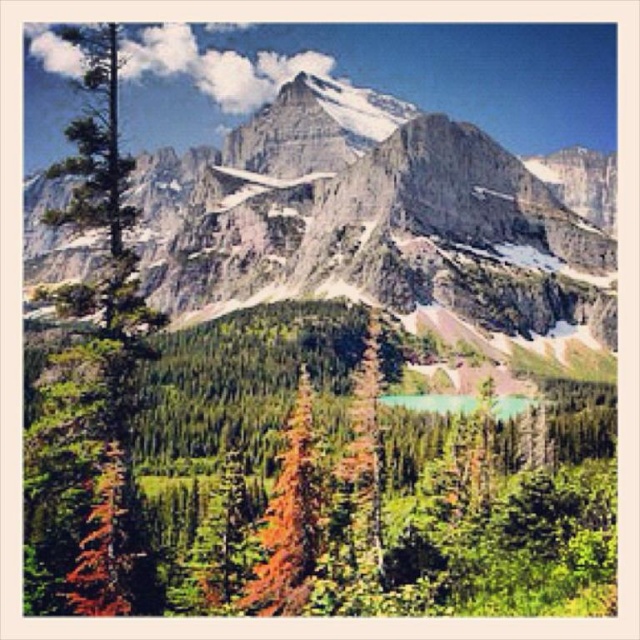
Question: Is orange-brown bark tree at center closer to the viewer compared to green glassy lake at center?

Choices:
 (A) yes
 (B) no

Answer: (A)

Question: Estimate the real-world distances between objects in this image. Which object is farther from the rocky gray mountain range at upper center?

Choices:
 (A) green matte tree at left
 (B) green glassy lake at center
 (C) green matte tree at center
 (D) orange-brown bark tree at center

Answer: (D)

Question: Which point is closer to the camera taking this photo?

Choices:
 (A) (45, 456)
 (B) (531, 404)
 (C) (355, 458)
 (D) (344, 211)

Answer: (A)

Question: Can you confirm if rocky gray mountain range at upper center is positioned to the right of green matte tree at center?

Choices:
 (A) yes
 (B) no

Answer: (A)

Question: Estimate the real-world distances between objects in this image. Which object is closer to the green matte tree at left?

Choices:
 (A) green matte tree at center
 (B) green glassy lake at center
 (C) orange-brown bark tree at center
 (D) rocky gray mountain range at upper center

Answer: (C)

Question: Can you confirm if rocky gray mountain range at upper center is bigger than orange-brown bark tree at center?

Choices:
 (A) no
 (B) yes

Answer: (B)